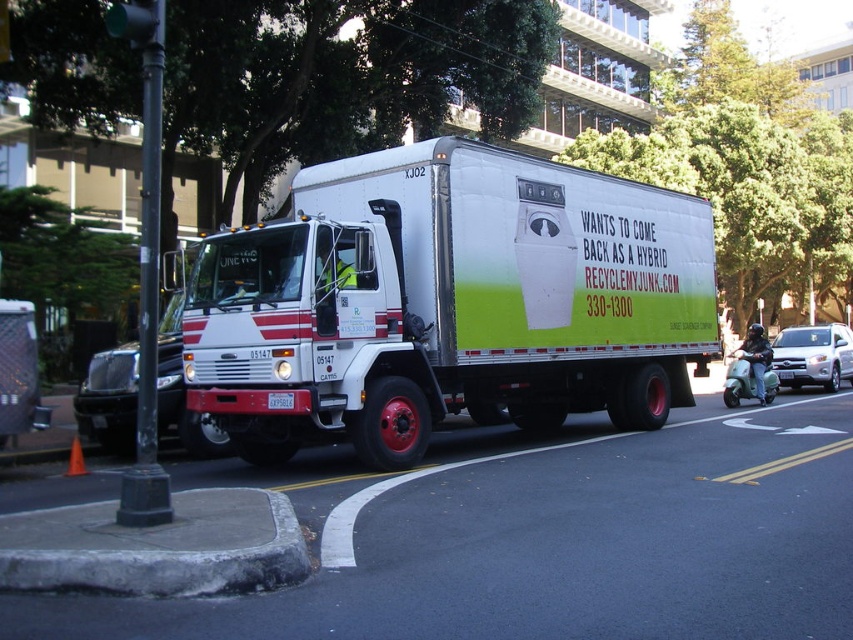
Does white matte truck at center appear on the right side of gray concrete curb at lower left?

Correct, you'll find white matte truck at center to the right of gray concrete curb at lower left.

Who is lower down, white matte truck at center or gray concrete curb at lower left?

Positioned lower is gray concrete curb at lower left.

Who is more forward, (569, 406) or (100, 509)?

Point (100, 509) is more forward.

You are a GUI agent. You are given a task and a screenshot of the screen. Output one action in this format:
    pyautogui.click(x=<x>, y=<y>)
    Task: Click on the white matte truck at center
    
    Given the screenshot: What is the action you would take?
    pyautogui.click(x=447, y=301)

Is gray concrete curb at lower left behind white plastic license plate at center?

No, gray concrete curb at lower left is closer to the viewer.

Who is higher up, gray concrete curb at lower left or white plastic license plate at center?

Positioned higher is white plastic license plate at center.

The image size is (853, 640). Describe the element at coordinates (157, 547) in the screenshot. I see `gray concrete curb at lower left` at that location.

Find the location of `gray concrete curb at lower left`. gray concrete curb at lower left is located at coordinates (157, 547).

Between silver metallic suv at right and white plastic license plate at center, which one is positioned higher?

white plastic license plate at center is higher up.

Find the location of a particular element. The image size is (853, 640). silver metallic suv at right is located at coordinates (813, 355).

What are the coordinates of `silver metallic suv at right` in the screenshot? It's located at (813, 355).